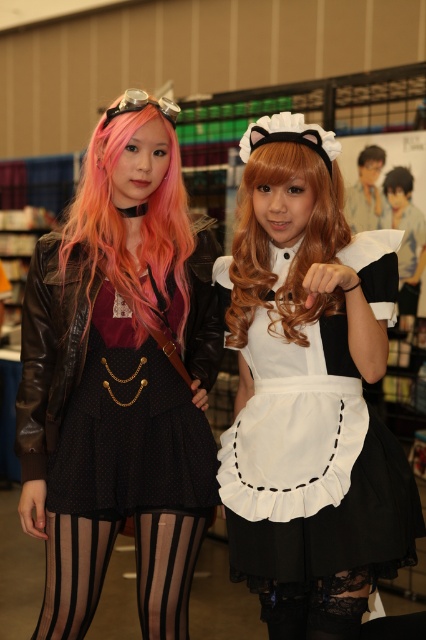
Question: Which point appears farthest from the camera in this image?

Choices:
 (A) (161, 168)
 (B) (406, 173)
 (C) (333, 477)

Answer: (B)

Question: Which point is farther from the camera taking this photo?

Choices:
 (A) (112, 170)
 (B) (379, 147)

Answer: (B)

Question: Estimate the real-world distances between objects in this image. Which object is farther from the sheer black striped tights at lower center?

Choices:
 (A) matte black dress at center
 (B) golden wavy hair at center

Answer: (B)

Question: Is white satin dress at center closer to camera compared to golden wavy hair at center?

Choices:
 (A) no
 (B) yes

Answer: (B)

Question: Can you confirm if golden wavy hair at center is positioned to the left of brown silky hair at upper right?

Choices:
 (A) no
 (B) yes

Answer: (B)

Question: Observing the image, what is the correct spatial positioning of black matte hair at upper right in reference to brown silky hair at upper right?

Choices:
 (A) below
 (B) above

Answer: (A)